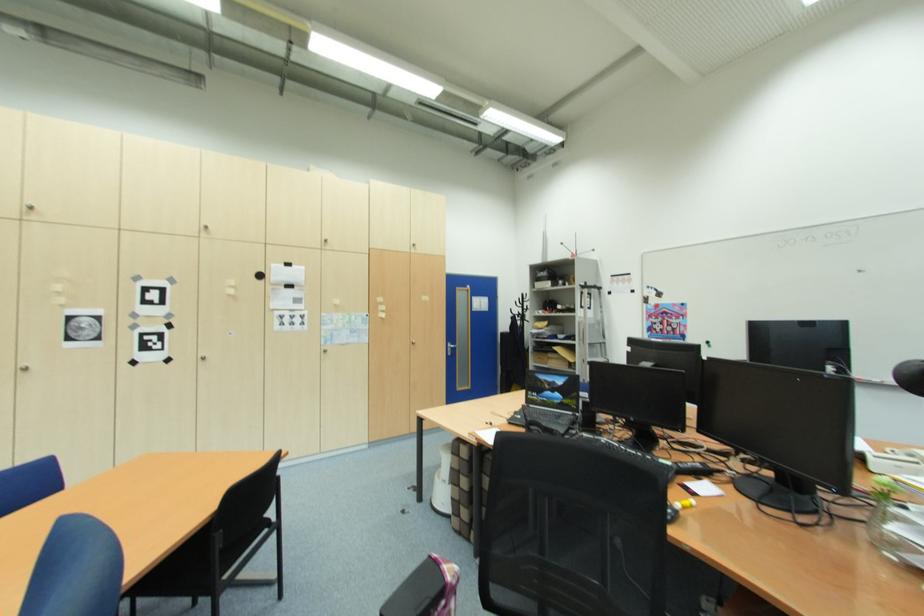
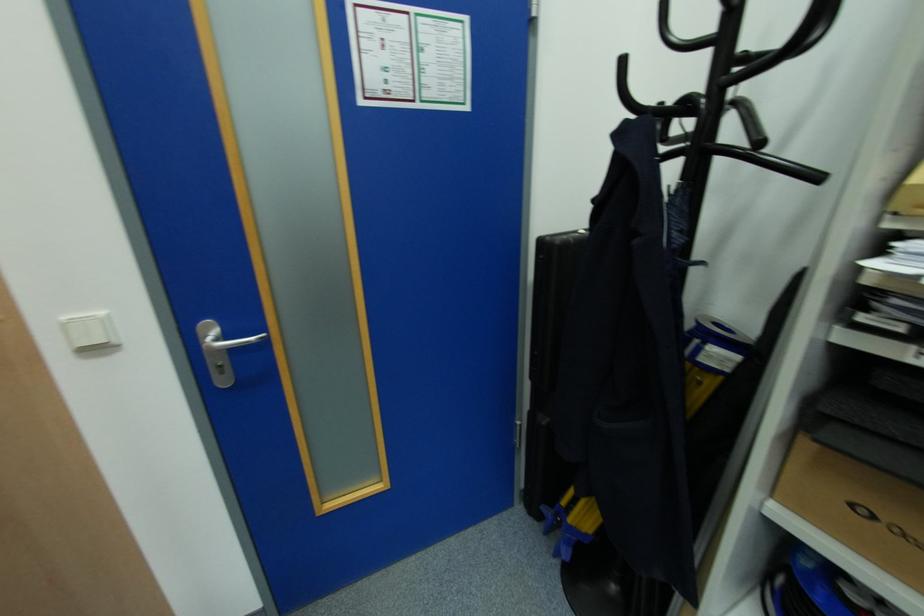
Locate, in the second image, the point that corresponds to (x=454, y=355) in the first image.

(227, 382)